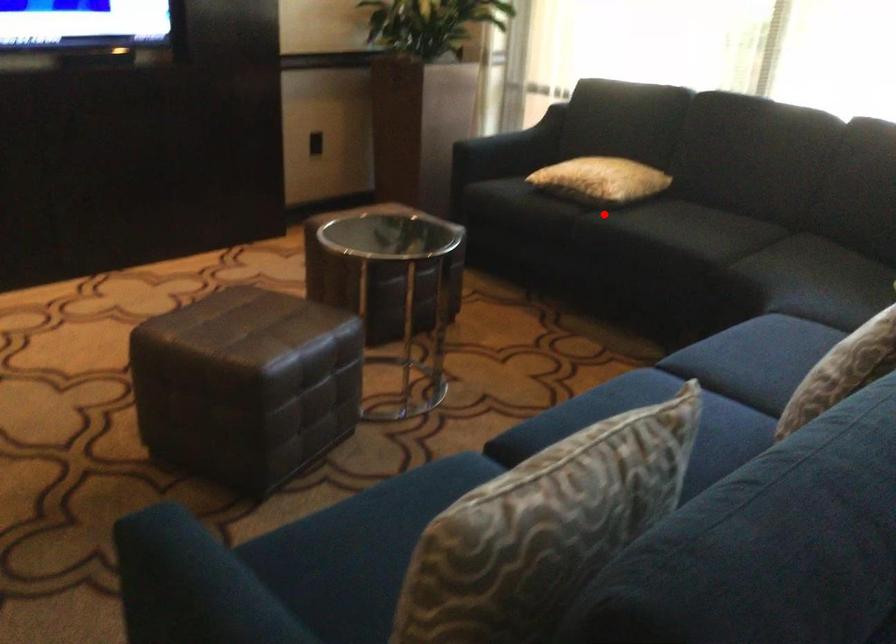
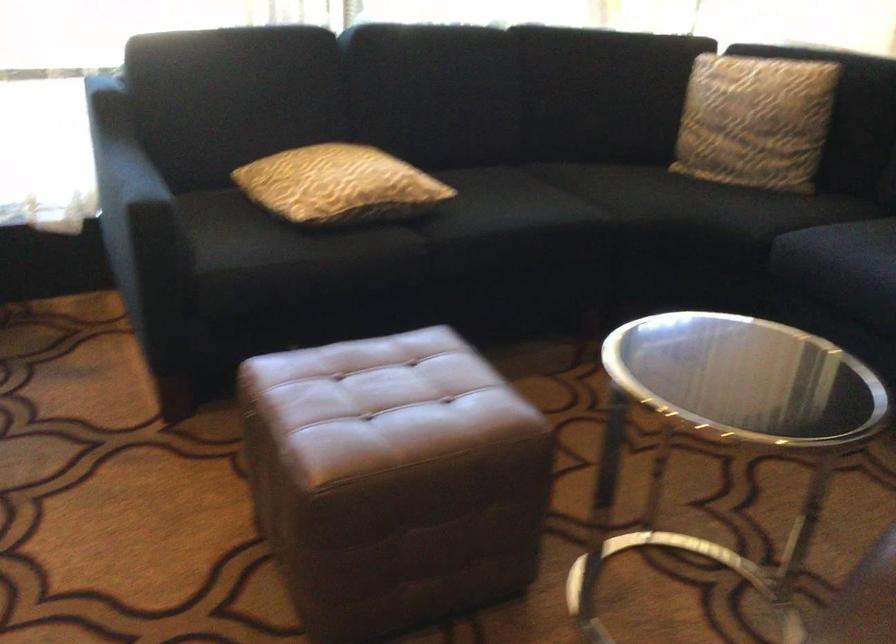
Question: I am providing you with two images of the same scene from different viewpoints. A red point is shown in image1. For the corresponding object point in image2, is it positioned nearer or farther from the camera?

Choices:
 (A) Nearer
 (B) Farther

Answer: (A)